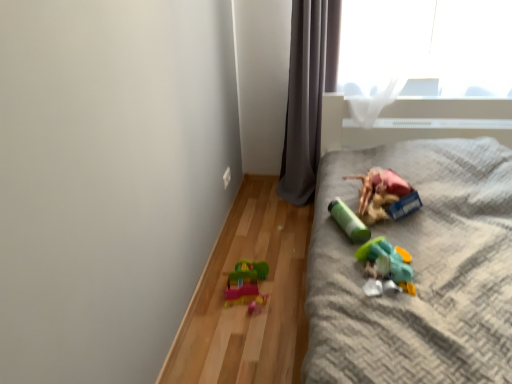
Where is `vacant space in translucent plastic toy at lower left, the 1th toy viewed from the left (from a real-world perspective)`? This screenshot has height=384, width=512. vacant space in translucent plastic toy at lower left, the 1th toy viewed from the left (from a real-world perspective) is located at coordinates (249, 298).